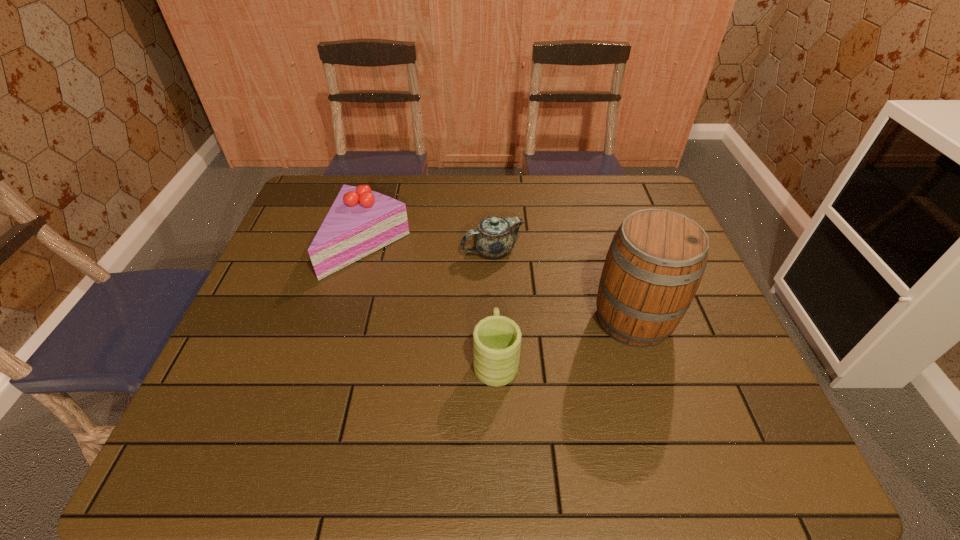
In order to click on free point that satisfies the following two spatial constraints: 1. from the spout of the chinaware; 2. on the side of the mug with the handle in this screenshot , I will do `click(495, 359)`.

Image resolution: width=960 pixels, height=540 pixels. In order to click on free space that satisfies the following two spatial constraints: 1. on the side of the mug with the handle; 2. on the right side of the rightmost object in this screenshot , I will do `click(494, 320)`.

Identify the location of free space that satisfies the following two spatial constraints: 1. on the back side of the tallest object; 2. from the spout of the chinaware. The width and height of the screenshot is (960, 540). (611, 251).

Where is `vacant space that satisfies the following two spatial constraints: 1. on the side of the mug with the handle; 2. from the spout of the chinaware`? The height and width of the screenshot is (540, 960). vacant space that satisfies the following two spatial constraints: 1. on the side of the mug with the handle; 2. from the spout of the chinaware is located at coordinates [x=492, y=251].